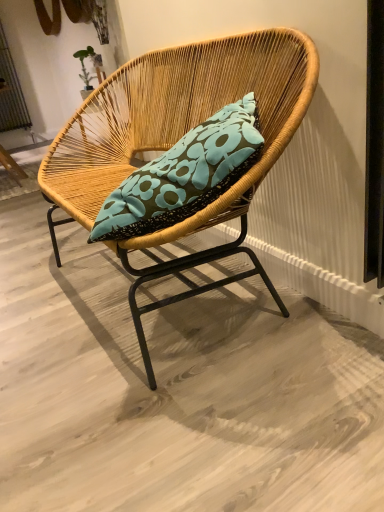
Question: Considering the positions of metallic silver screen door at upper left and natural woven chair at center in the image, is metallic silver screen door at upper left bigger or smaller than natural woven chair at center?

Choices:
 (A) big
 (B) small

Answer: (B)

Question: Is metallic silver screen door at upper left in front of or behind natural woven chair at center in the image?

Choices:
 (A) front
 (B) behind

Answer: (B)

Question: Looking at their shapes, would you say metallic silver screen door at upper left is wider or thinner than natural woven chair at center?

Choices:
 (A) wide
 (B) thin

Answer: (B)

Question: From a real-world perspective, is natural woven chair at center positioned above or below metallic silver screen door at upper left?

Choices:
 (A) below
 (B) above

Answer: (A)

Question: Would you say natural woven chair at center is to the left or to the right of metallic silver screen door at upper left in the picture?

Choices:
 (A) right
 (B) left

Answer: (A)

Question: Looking at the image, does natural woven chair at center seem bigger or smaller compared to metallic silver screen door at upper left?

Choices:
 (A) big
 (B) small

Answer: (A)

Question: From the image's perspective, is natural woven chair at center located above or below metallic silver screen door at upper left?

Choices:
 (A) below
 (B) above

Answer: (A)